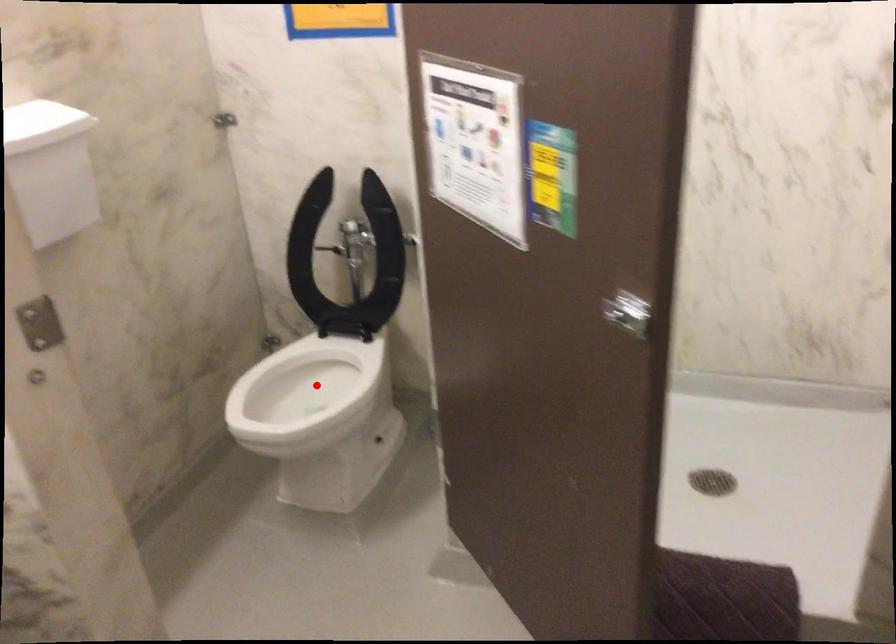
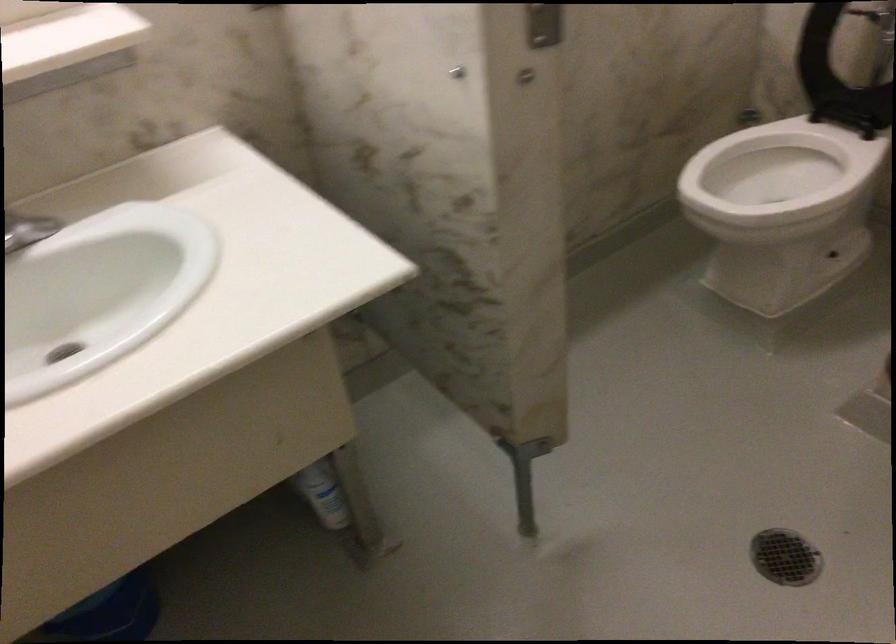
Question: A red point is marked in image1. In image2, is the corresponding 3D point closer to the camera or farther? Reply with the corresponding letter.

Choices:
 (A) The corresponding 3D point is closer.
 (B) The corresponding 3D point is farther.

Answer: (A)